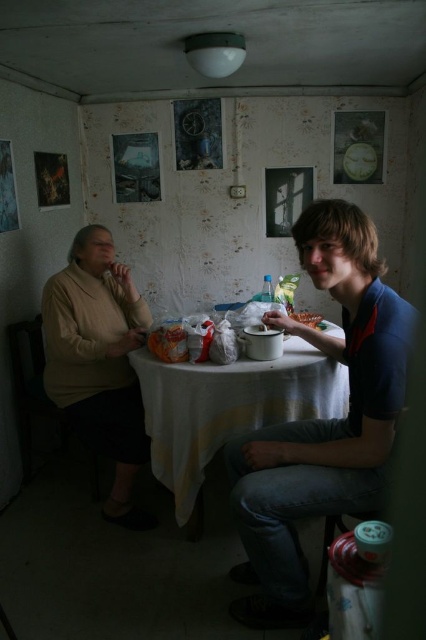
Question: Which point is farther to the camera?

Choices:
 (A) matte beige sweater at left
 (B) blue cotton shirt at right

Answer: (A)

Question: Can you confirm if white cloth table at center is positioned to the right of white matte bowl at table center?

Choices:
 (A) no
 (B) yes

Answer: (A)

Question: Does blue cotton shirt at right appear on the right side of matte beige sweater at left?

Choices:
 (A) no
 (B) yes

Answer: (B)

Question: Which point is farther to the camera?

Choices:
 (A) (308, 316)
 (B) (262, 376)
 (C) (302, 516)

Answer: (A)

Question: Which of the following is the farthest from the observer?

Choices:
 (A) blue cotton shirt at right
 (B) white matte bowl at table center

Answer: (B)

Question: Does white cloth table at center have a smaller size compared to white matte bowl at table center?

Choices:
 (A) yes
 (B) no

Answer: (B)